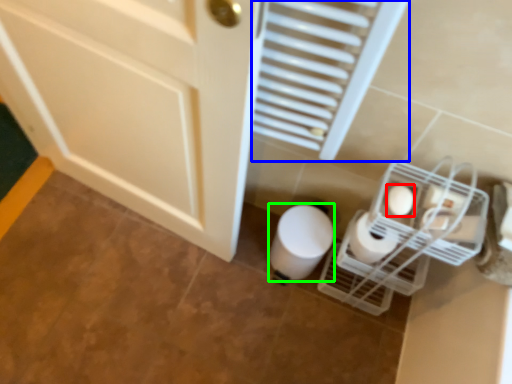
Question: Considering the real-world distances, which object is farthest from toilet paper (highlighted by a red box)? radiator (highlighted by a blue box) or toilet paper (highlighted by a green box)?

Choices:
 (A) radiator
 (B) toilet paper

Answer: (B)